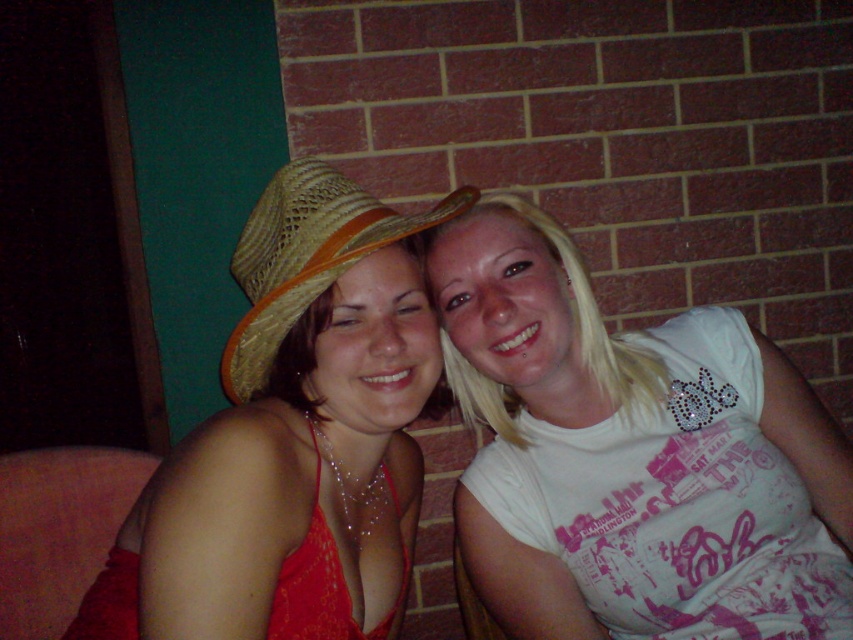
You are a photographer trying to capture a closeup of the matte straw hat at left. The camera you are using has a focal length of 50mm and an aperture of f2.8. The hat is positioned at point 0.686, 0.342 in the frame. To ensure the hat is in focus, what adjustment should you make to the camera settings?

The matte straw hat at left is positioned at point (291,438) in the frame. To ensure it is in focus, adjust the camera focus to that specific point.